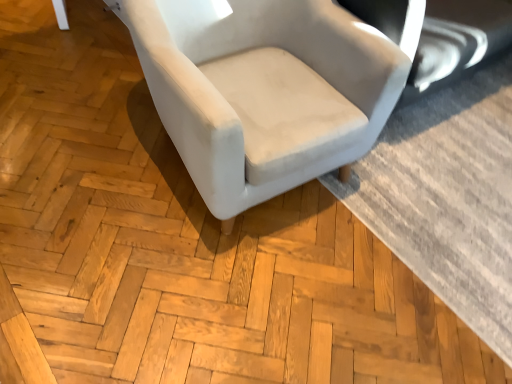
Locate an element on the screen. The height and width of the screenshot is (384, 512). blank space to the left of white velvet chair at center is located at coordinates (79, 115).